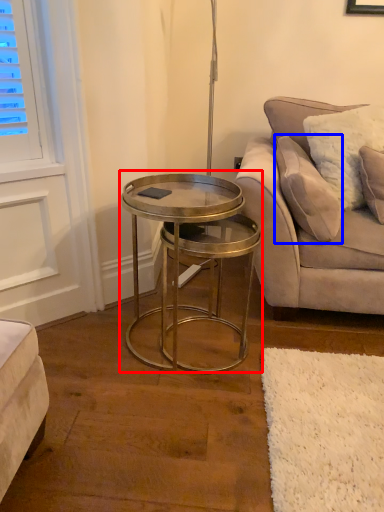
Question: Which of the following is the farthest to the observer, coffee table (highlighted by a red box) or pillow (highlighted by a blue box)?

Choices:
 (A) coffee table
 (B) pillow

Answer: (B)